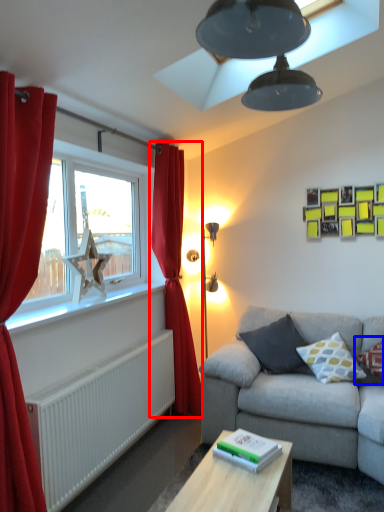
Question: Which object is further to the camera taking this photo, curtain (highlighted by a red box) or pillow (highlighted by a blue box)?

Choices:
 (A) curtain
 (B) pillow

Answer: (A)